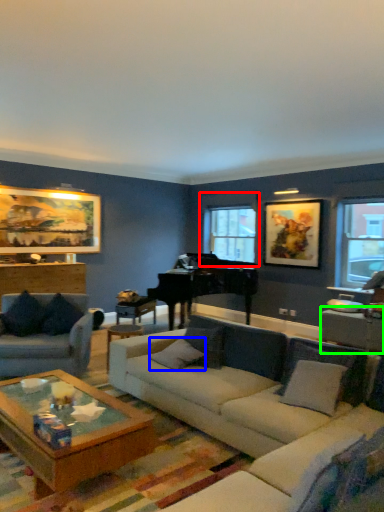
Question: Based on their relative distances, which object is farther from window (highlighted by a red box)? Choose from pillow (highlighted by a blue box) and table (highlighted by a green box).

Choices:
 (A) pillow
 (B) table

Answer: (B)